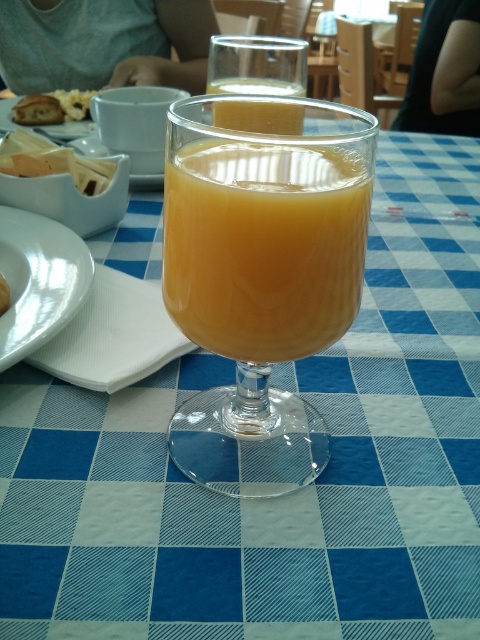
Can you confirm if translucent glass at center is thinner than matte white napkin at lower left?

In fact, translucent glass at center might be wider than matte white napkin at lower left.

At what (x,y) coordinates should I click in order to perform the action: click on translucent glass at center. Please return your answer as a coordinate pair (x, y). The height and width of the screenshot is (640, 480). Looking at the image, I should click on (259, 116).

Who is more distant from viewer, (249, 83) or (1, 308)?

The point (249, 83) is more distant.

Find the location of a particular element. translucent glass at center is located at coordinates (259, 116).

Describe the element at coordinates (52, 108) in the screenshot. The image size is (480, 640). I see `matte brown bread at upper left` at that location.

Does matte brown bread at upper left appear on the right side of matte white napkin at lower left?

Incorrect, matte brown bread at upper left is not on the right side of matte white napkin at lower left.

Identify the location of matte brown bread at upper left. (52, 108).

Does translucent orange juice at center have a lesser width compared to matte white napkin at lower left?

No, translucent orange juice at center is not thinner than matte white napkin at lower left.

Is point (235, 332) behind point (3, 307)?

No, (235, 332) is in front of (3, 307).

Locate an element on the screen. This screenshot has width=480, height=640. translucent orange juice at center is located at coordinates (264, 246).